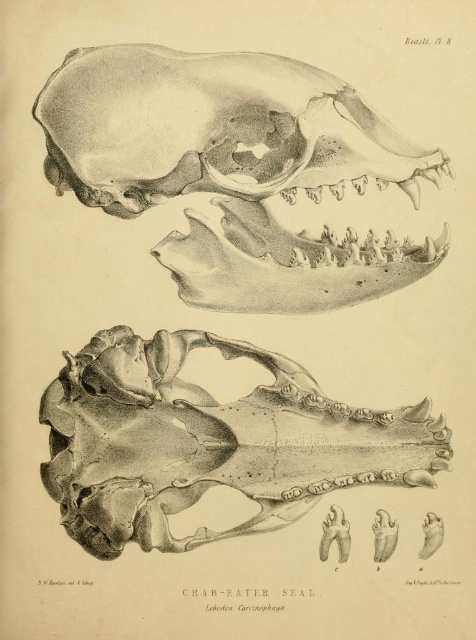
Question: Is gray pencil sketch skull at upper center behind gray bone skull at center?

Choices:
 (A) no
 (B) yes

Answer: (A)

Question: Among these points, which one is nearest to the camera?

Choices:
 (A) (250, 285)
 (B) (102, 524)

Answer: (B)

Question: Does gray pencil sketch skull at upper center appear on the left side of gray bone skull at center?

Choices:
 (A) no
 (B) yes

Answer: (B)

Question: Can you confirm if gray pencil sketch skull at upper center is positioned above gray bone skull at center?

Choices:
 (A) yes
 (B) no

Answer: (A)

Question: Which point is farther to the camera?

Choices:
 (A) gray pencil sketch skull at upper center
 (B) gray bone skull at center

Answer: (B)